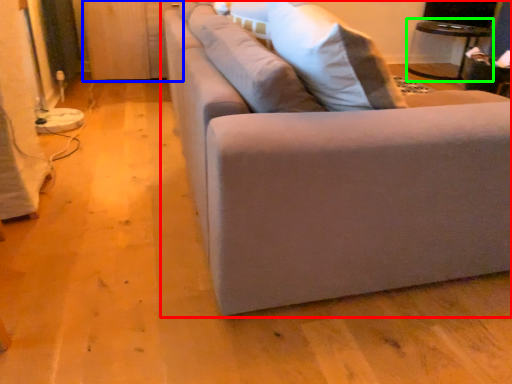
Question: Which object is positioned closest to studio couch (highlighted by a red box)? Select from dresser (highlighted by a blue box) and table (highlighted by a green box).

Choices:
 (A) dresser
 (B) table

Answer: (A)